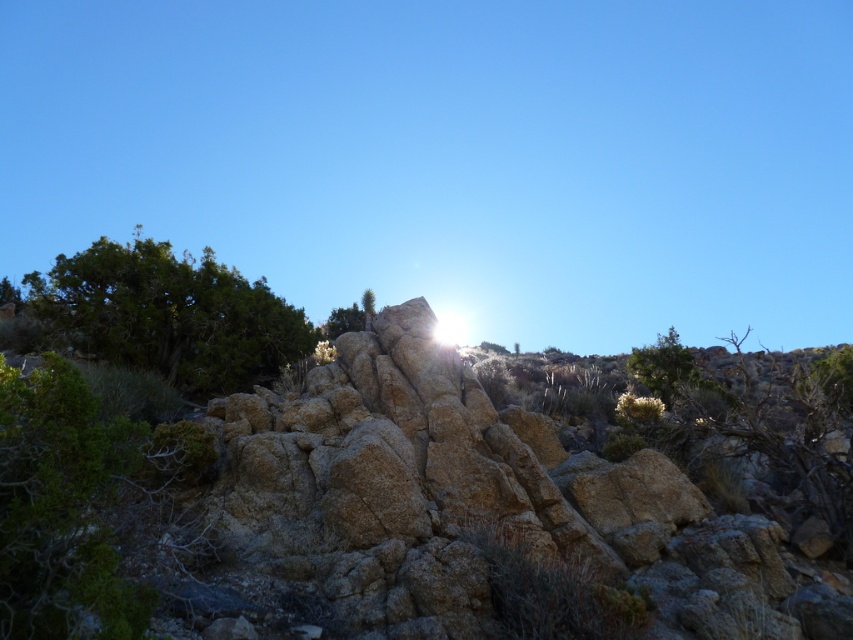
Question: Is green leafy tree at upper left behind green leafy tree at upper right?

Choices:
 (A) no
 (B) yes

Answer: (A)

Question: Does green leafy tree at upper left have a lesser width compared to green leafy tree at upper right?

Choices:
 (A) yes
 (B) no

Answer: (B)

Question: Is green leafy tree at upper left to the left of green leafy tree at upper right from the viewer's perspective?

Choices:
 (A) yes
 (B) no

Answer: (A)

Question: Which point appears farthest from the camera in this image?

Choices:
 (A) (666, 401)
 (B) (155, 365)

Answer: (A)

Question: Which object appears closest to the camera in this image?

Choices:
 (A) green leafy tree at upper left
 (B) green leafy tree at upper right

Answer: (A)